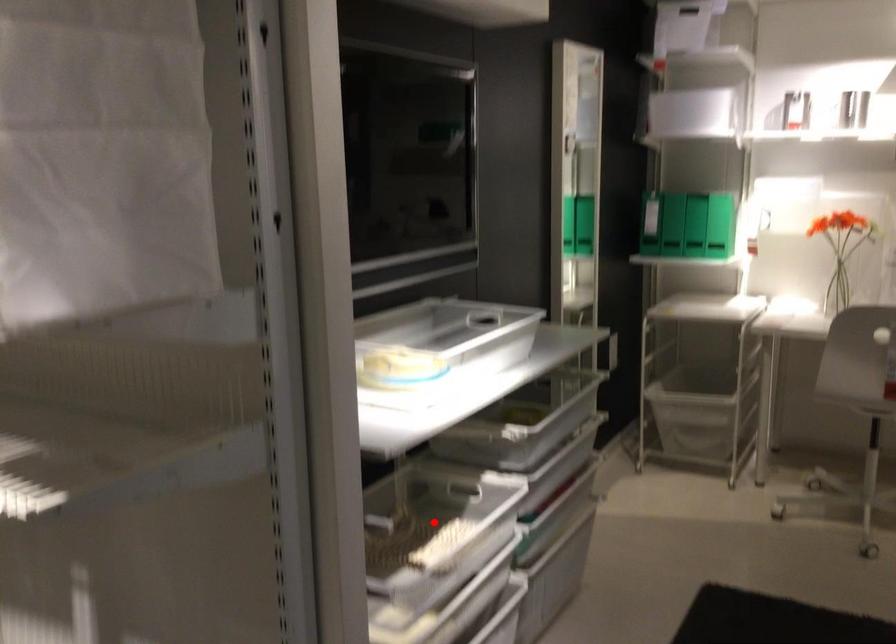
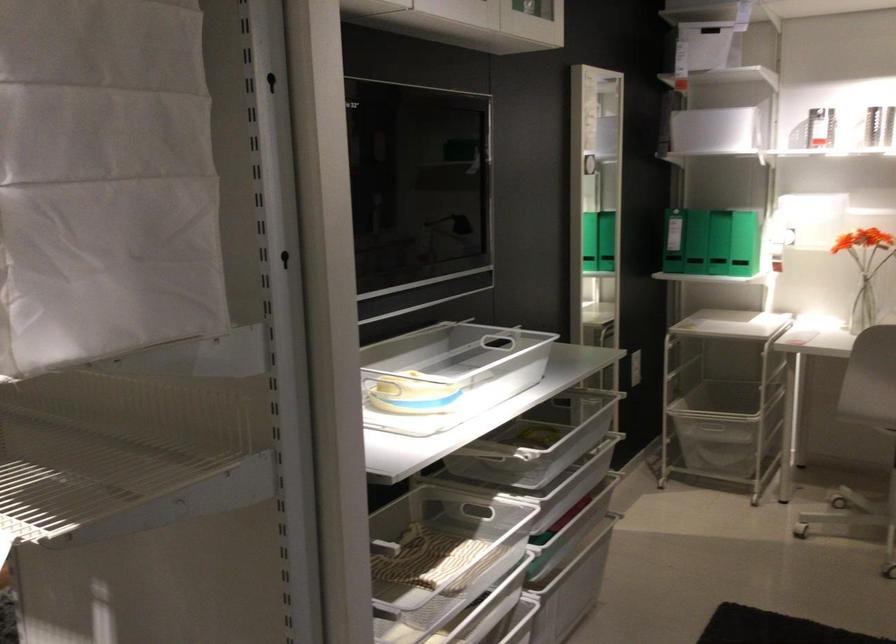
Locate, in the second image, the point that corresponds to the highlighted location in the first image.

(441, 544)